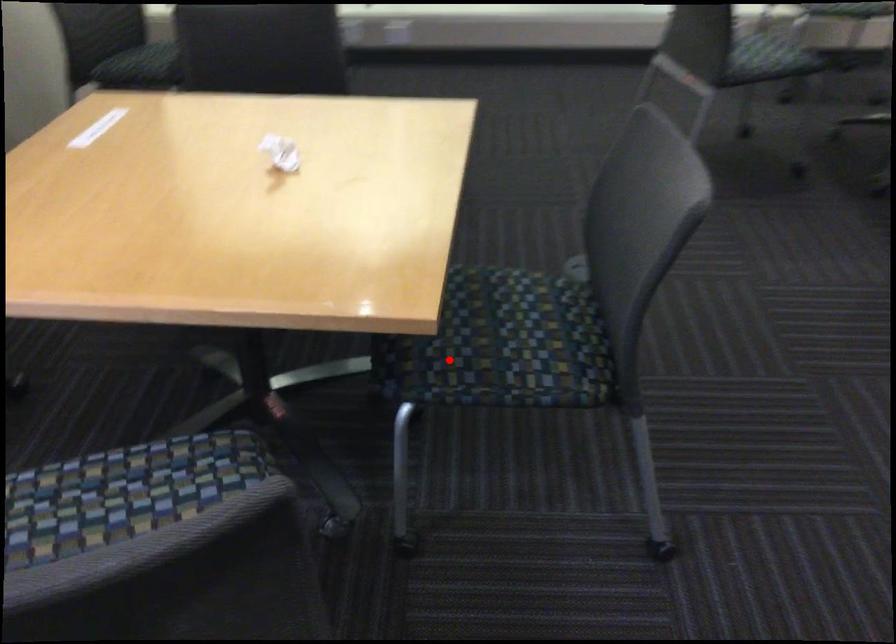
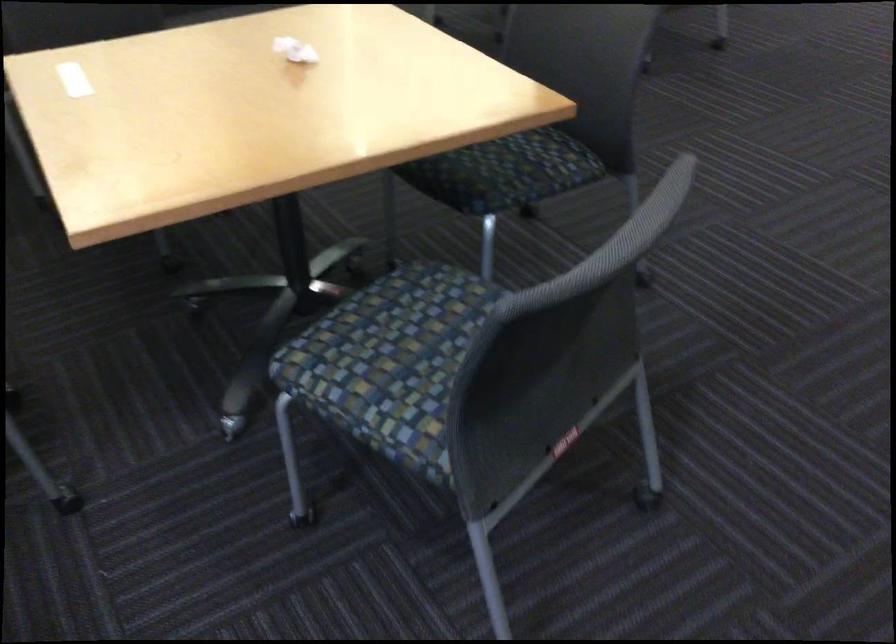
Question: A red point is marked in image1. In image2, is the corresponding 3D point closer to the camera or farther? Reply with the corresponding letter.

Choices:
 (A) The corresponding 3D point is closer.
 (B) The corresponding 3D point is farther.

Answer: (B)